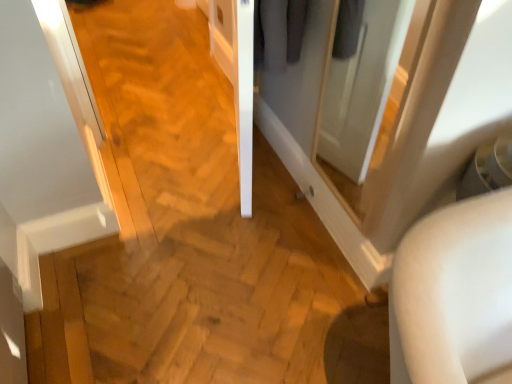
In order to face white matte chair at lower right, should I rotate leftwards or rightwards?

To align with it, rotate right about 29.954°.

What are the coordinates of `white matte chair at lower right` in the screenshot? It's located at (454, 295).

What do you see at coordinates (454, 295) in the screenshot? The height and width of the screenshot is (384, 512). I see `white matte chair at lower right` at bounding box center [454, 295].

At what (x,y) coordinates should I click in order to perform the action: click on white matte chair at lower right. Please return your answer as a coordinate pair (x, y). Looking at the image, I should click on (454, 295).